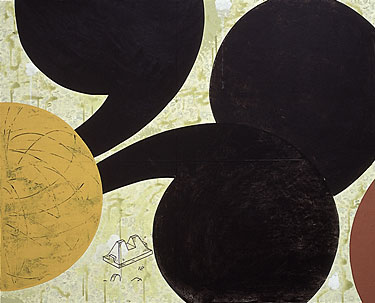
Identify the location of stand. The width and height of the screenshot is (375, 303). (130, 251).